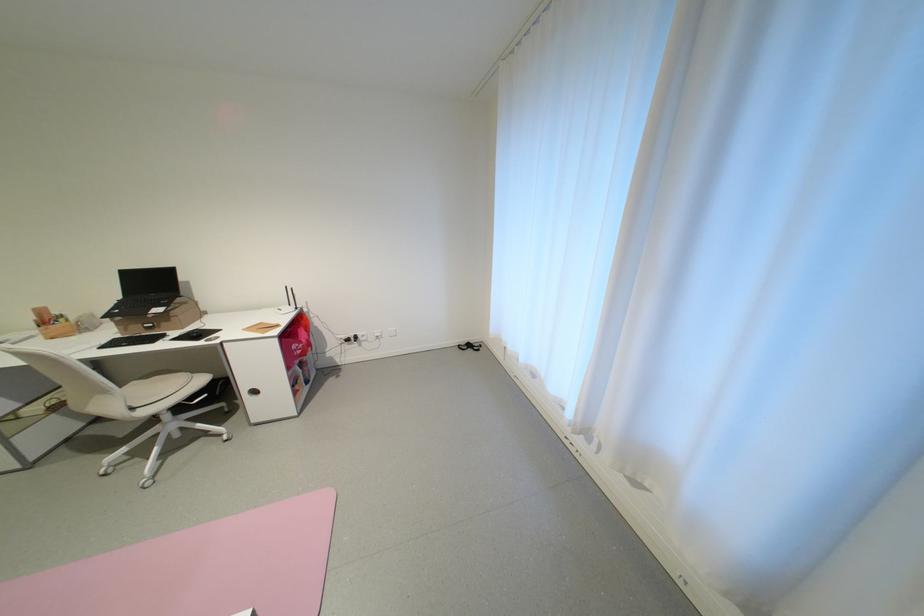
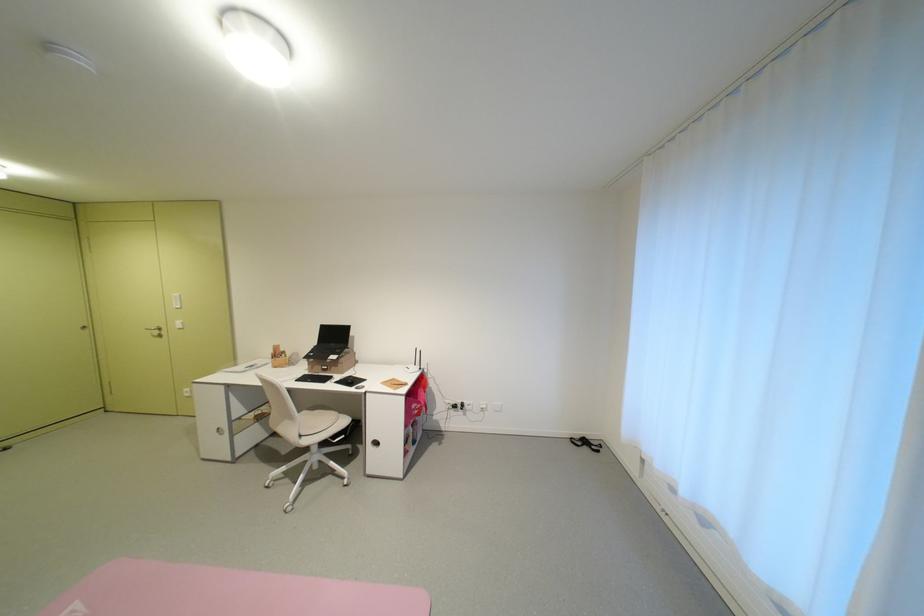
Question: The images are taken continuously from a first-person perspective. In which direction is your viewpoint rotating?

Choices:
 (A) Left
 (B) Right
 (C) Up
 (D) Down

Answer: (A)